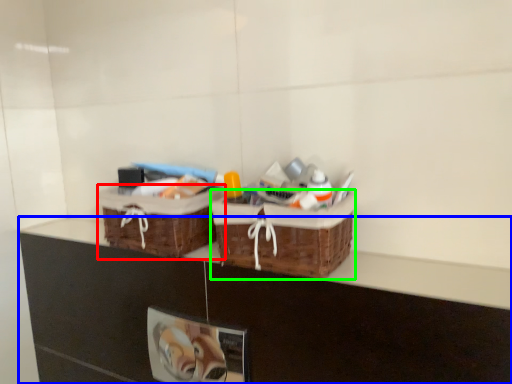
Question: Estimate the real-world distances between objects in this image. Which object is farther from picnic basket (highlighted by a red box), counter (highlighted by a blue box) or picnic basket (highlighted by a green box)?

Choices:
 (A) counter
 (B) picnic basket

Answer: (B)